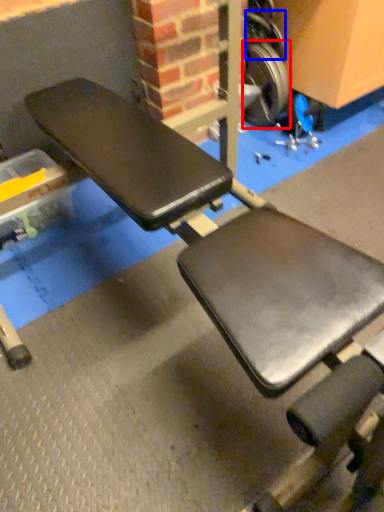
Question: Which of the following is the closest to the observer, wheel (highlighted by a red box) or wheel (highlighted by a blue box)?

Choices:
 (A) wheel
 (B) wheel

Answer: (B)